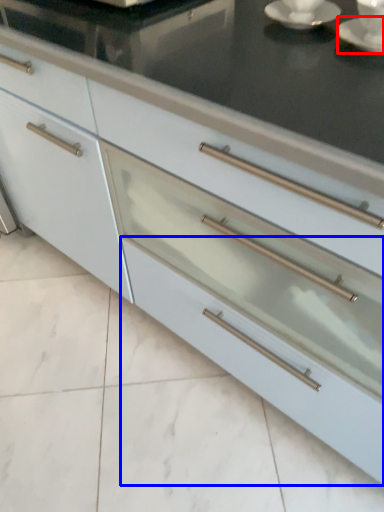
Question: Which point is closer to the camera, saucer (highlighted by a red box) or drawer (highlighted by a blue box)?

Choices:
 (A) saucer
 (B) drawer

Answer: (A)